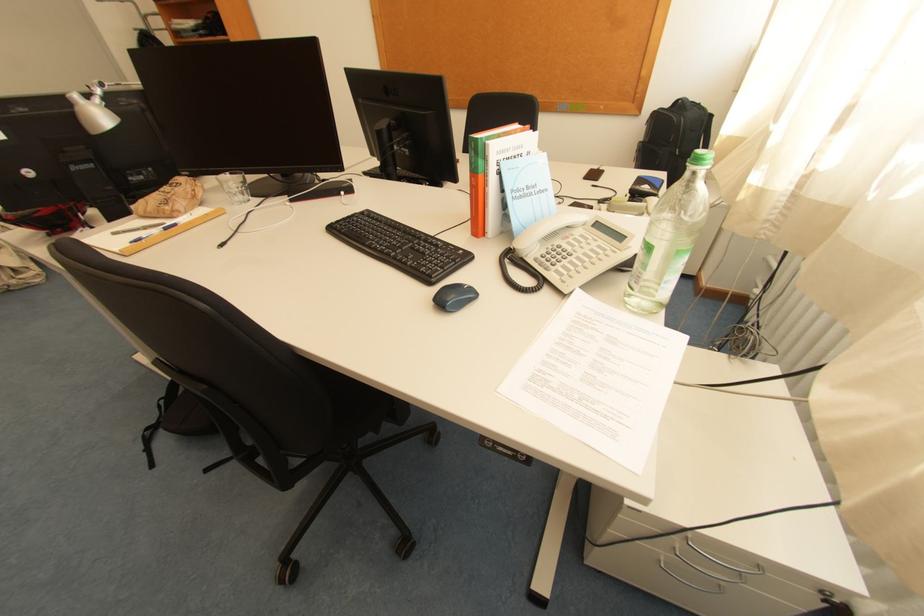
This screenshot has height=616, width=924. What are the coordinates of `telephone handset` in the screenshot? It's located at (548, 229).